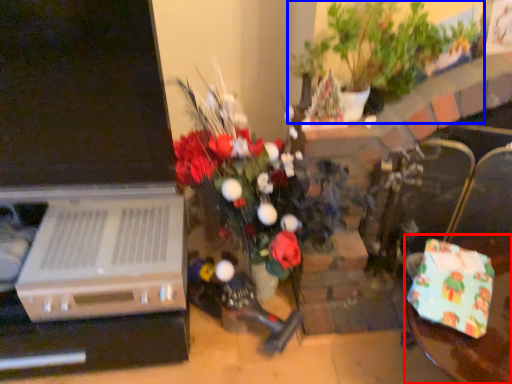
Question: Which object is further to the camera taking this photo, table (highlighted by a red box) or houseplant (highlighted by a blue box)?

Choices:
 (A) table
 (B) houseplant

Answer: (B)